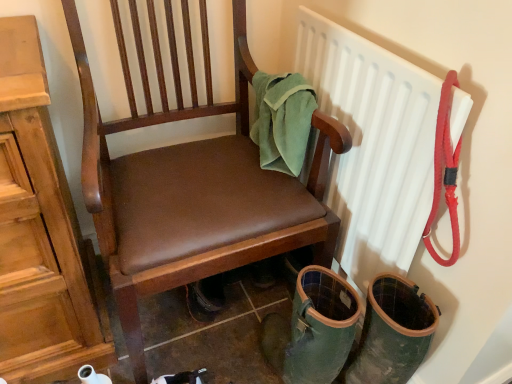
Question: Is point (134, 302) closer or farther from the camera than point (285, 122)?

Choices:
 (A) farther
 (B) closer

Answer: (B)

Question: Based on their positions, is brown leather chair at center located to the left or right of green felt towel at upper right?

Choices:
 (A) left
 (B) right

Answer: (A)

Question: Considering the real-world distances, which object is farthest from the white plastic radiator at upper right?

Choices:
 (A) green felt towel at upper right
 (B) brown leather chair at center

Answer: (B)

Question: Considering the real-world distances, which object is closest to the green felt towel at upper right?

Choices:
 (A) brown leather chair at center
 (B) white plastic radiator at upper right

Answer: (B)